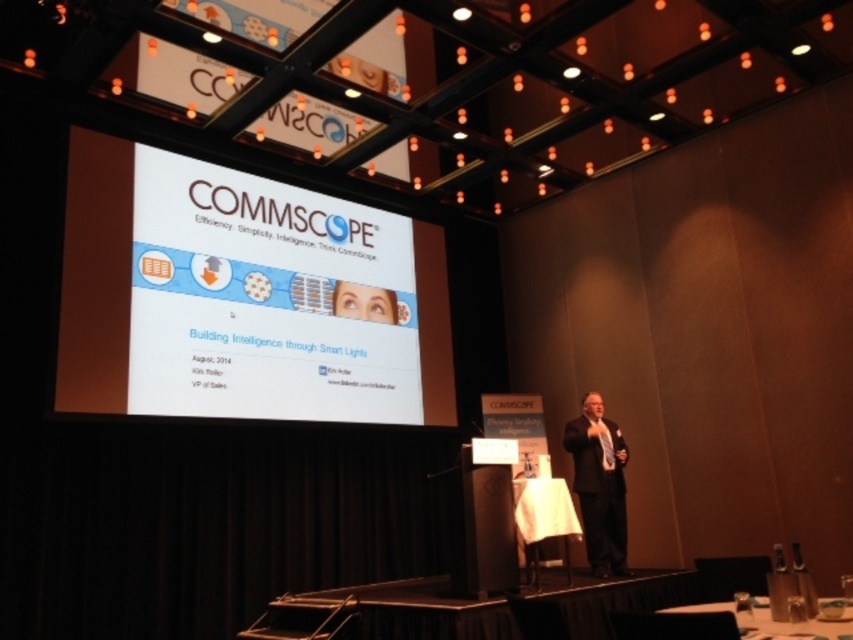
Can you confirm if white glossy projection screen at upper center is positioned to the right of black suit at center?

No, white glossy projection screen at upper center is not to the right of black suit at center.

Is white glossy projection screen at upper center below black suit at center?

No.

Is point (410, 266) more distant than point (585, 496)?

That is True.

The image size is (853, 640). In order to click on white glossy projection screen at upper center in this screenshot , I will do `click(242, 296)`.

Is white glossy projection screen at upper center positioned before white cloth at center?

Yes, it is.

Does white glossy projection screen at upper center have a greater width compared to white cloth at center?

Indeed, white glossy projection screen at upper center has a greater width compared to white cloth at center.

Is point (108, 204) farther from camera compared to point (535, 547)?

Yes, it is.

Identify the location of white glossy projection screen at upper center. (242, 296).

Can you confirm if black suit at center is positioned below white cloth at center?

Incorrect, black suit at center is not positioned below white cloth at center.

Is point (583, 529) less distant than point (561, 524)?

No, (583, 529) is further to viewer.

Locate an element on the screen. Image resolution: width=853 pixels, height=640 pixels. black suit at center is located at coordinates (599, 484).